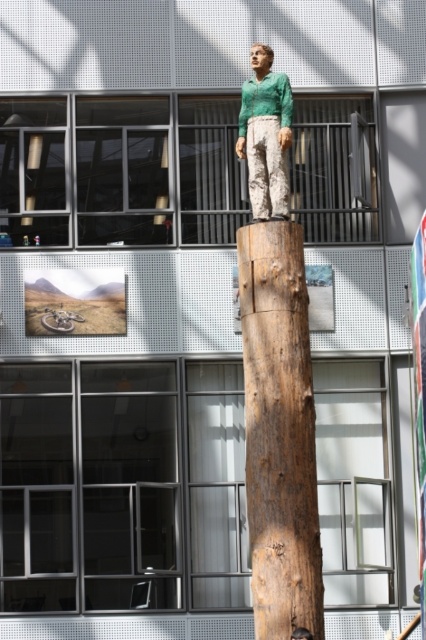
You are standing in the modern indoor space described. There is a point marked at coordinates (279, 432). What object is located at that point?

The brown rough wood at center is located at point (279, 432).

You are an interior designer planning to place a new decorative item in the room. The item requires a stable surface at least 1 meter away from the brown rough wood at center. Where should you place it based on its coordinates?

Since the brown rough wood at center is located at point (279,432), you should place the new decorative item at a position that maintains a distance of at least 1 meter from these coordinates to ensure stability and compliance with the requirement.